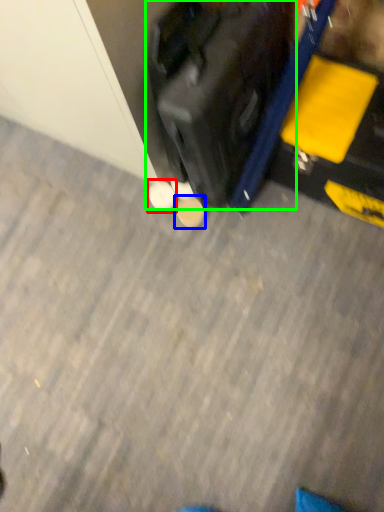
Question: Based on their relative distances, which object is farther from footwear (highlighted by a red box)? Choose from footwear (highlighted by a blue box) and suitcase (highlighted by a green box).

Choices:
 (A) footwear
 (B) suitcase

Answer: (B)